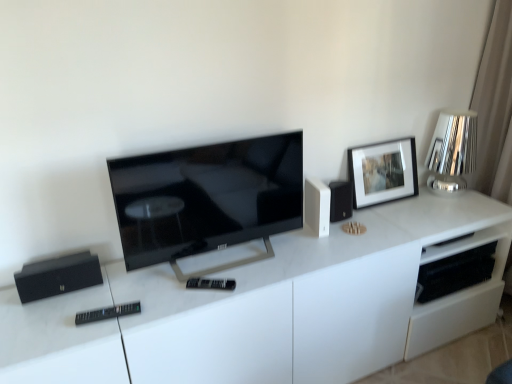
Image resolution: width=512 pixels, height=384 pixels. I want to click on vacant space to the right of matte black tv at center, so click(310, 258).